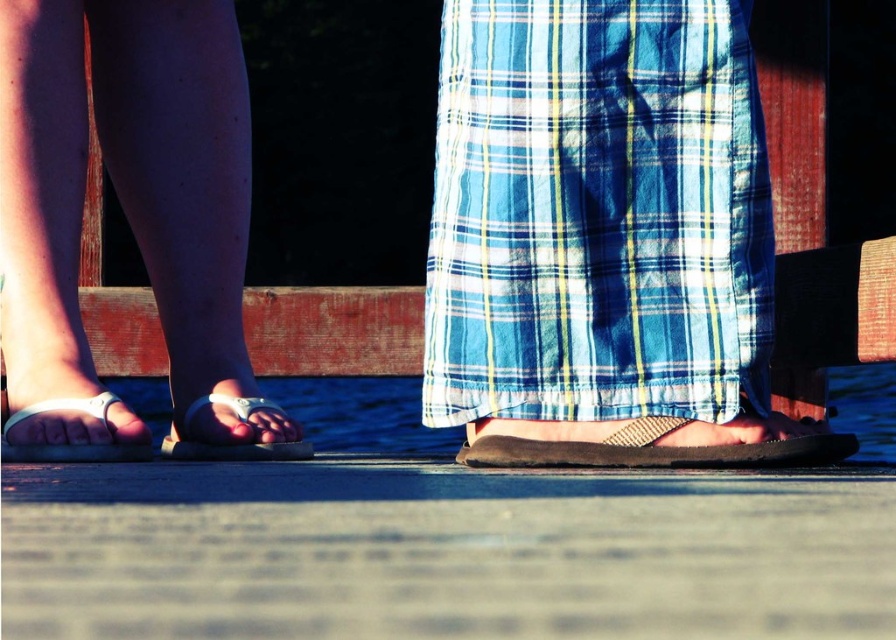
Question: Can you confirm if white plastic sandals at left is positioned below white leather sandal at lower center?

Choices:
 (A) no
 (B) yes

Answer: (A)

Question: Which is nearer to the brown suede sandal at center?

Choices:
 (A) white leather sandal at lower center
 (B) blue plaid skirt at center
 (C) white plastic sandals at left

Answer: (B)

Question: Observing the image, what is the correct spatial positioning of white plastic sandals at left in reference to white leather sandal at lower center?

Choices:
 (A) right
 (B) left

Answer: (B)

Question: Which point is closer to the camera taking this photo?

Choices:
 (A) (561, 396)
 (B) (791, 461)

Answer: (B)

Question: Which object is the closest to the white leather sandal at lower center?

Choices:
 (A) white plastic sandal at lower left
 (B) brown suede sandal at center
 (C) white plastic sandals at left
 (D) blue plaid skirt at center

Answer: (A)

Question: In this image, where is blue plaid skirt at center located relative to white plastic sandal at lower left?

Choices:
 (A) right
 (B) left

Answer: (A)